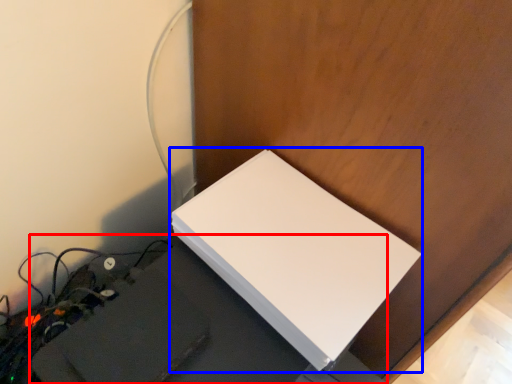
Question: Which object is further to the camera taking this photo, computer desk (highlighted by a red box) or Wii (highlighted by a blue box)?

Choices:
 (A) computer desk
 (B) Wii

Answer: (B)